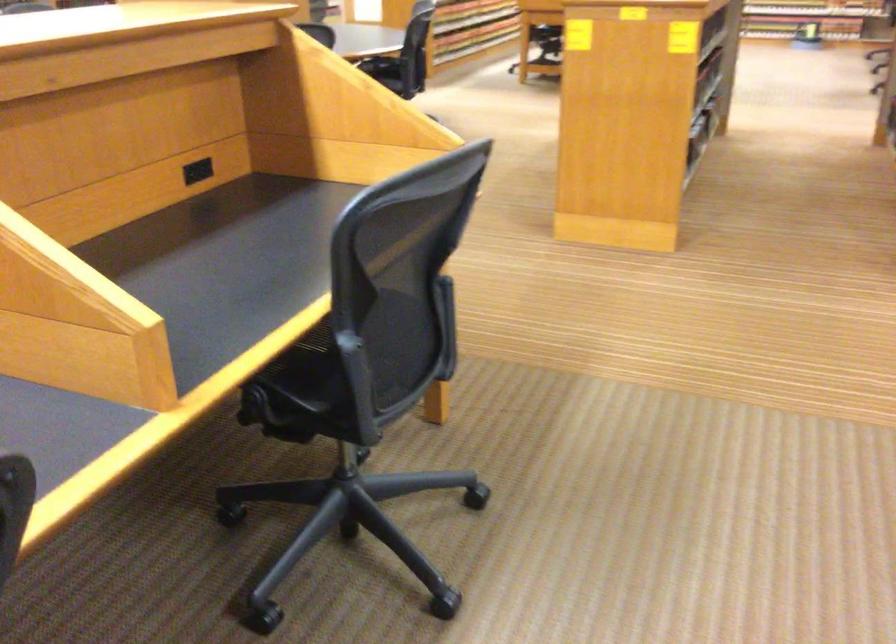
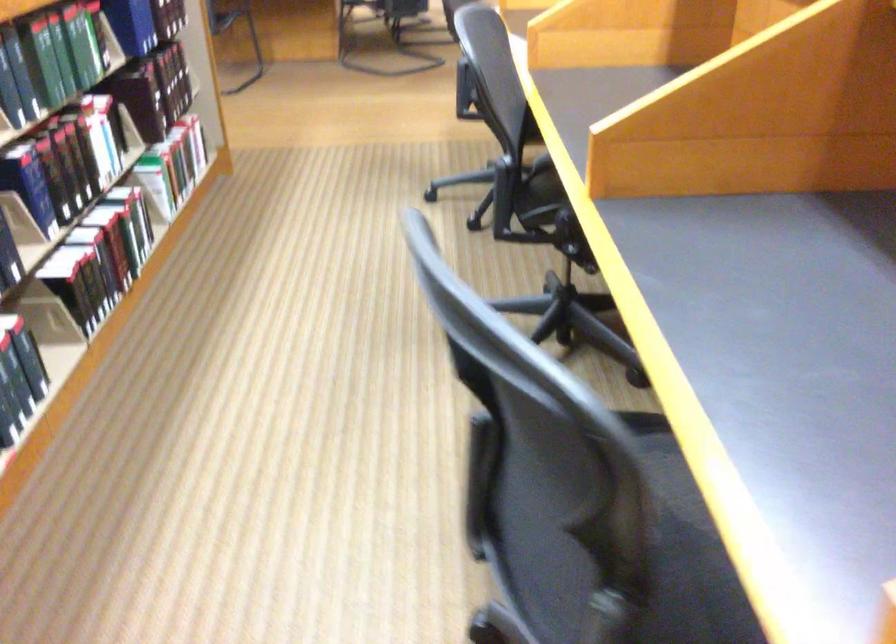
Question: In a continuous first-person perspective shot, in which direction is the camera moving?

Choices:
 (A) Left
 (B) Right
 (C) Forward
 (D) Backward

Answer: (A)